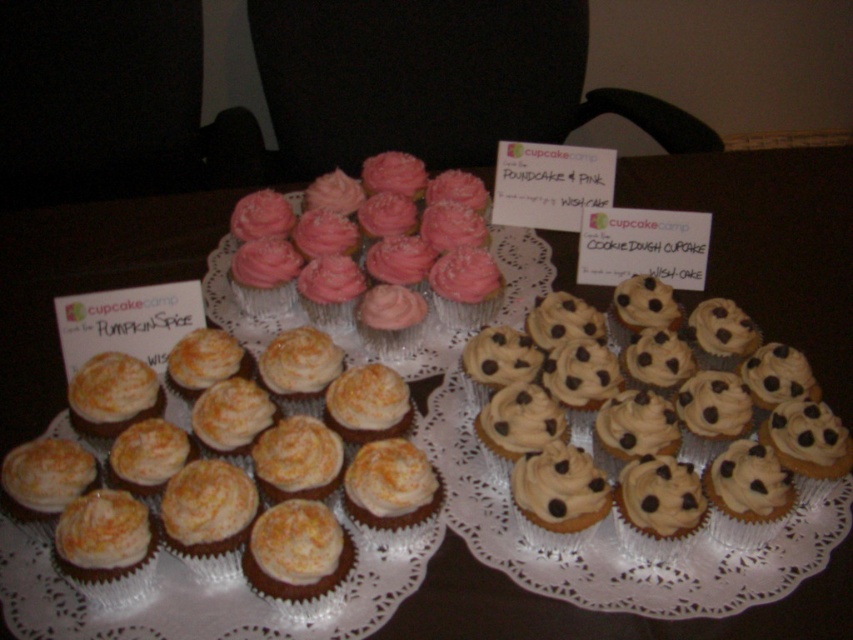
You are a baker trying to arrange cupcakes on a shelf. The shelf has a width limit of 10 cm. You have two cupcakes to place there. The matte orange frosting cupcake at lower left and the orange frosted cupcake at center. Which cupcake can fit on the shelf if the shelf can only accommodate the narrower one?

The orange frosted cupcake at center can fit on the shelf since it is narrower than the matte orange frosting cupcake at lower left.